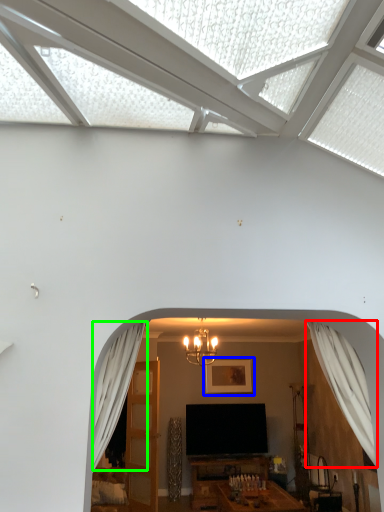
Question: Estimate the real-world distances between objects in this image. Which object is farther from curtain (highlighted by a red box), picture frame (highlighted by a blue box) or curtain (highlighted by a green box)?

Choices:
 (A) picture frame
 (B) curtain

Answer: (A)